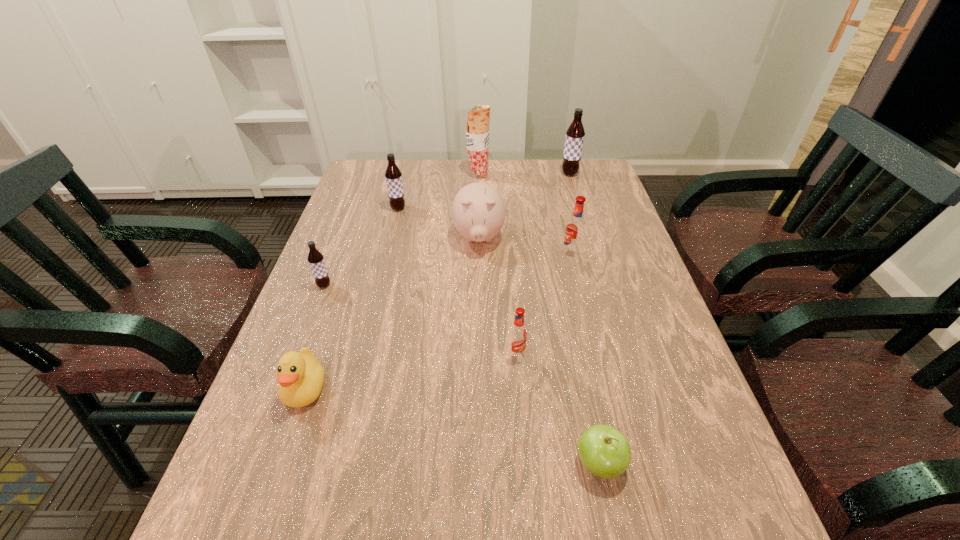
The height and width of the screenshot is (540, 960). In order to click on vacant space at the near edge of the desktop in this screenshot , I will do `click(338, 538)`.

Locate an element on the screen. vacant space at the left edge of the desktop is located at coordinates (315, 493).

In the image, there is a desktop. Identify the location of vacant space at the right edge. Image resolution: width=960 pixels, height=540 pixels. (609, 286).

At what (x,y) coordinates should I click in order to perform the action: click on vacant space at the near left corner. Please return your answer as a coordinate pair (x, y). Image resolution: width=960 pixels, height=540 pixels. Looking at the image, I should click on (257, 534).

The image size is (960, 540). Find the location of `vacant space at the far right corner of the desktop`. vacant space at the far right corner of the desktop is located at coordinates (568, 192).

Identify the location of vacant area between the burrito and the second shortest object. The height and width of the screenshot is (540, 960). (392, 281).

Locate an element on the screen. The image size is (960, 540). free space between the bigger red root beer and the second nearest root beer is located at coordinates pos(447,270).

I want to click on free space that is in between the nearest object and the farthest brown root beer, so point(585,319).

At what (x,y) coordinates should I click in order to perform the action: click on unoccupied position between the shortest object and the nearest brown root beer. Please return your answer as a coordinate pair (x, y). The width and height of the screenshot is (960, 540). Looking at the image, I should click on (462, 374).

Find the location of a particular element. This screenshot has height=540, width=960. vacant area between the third root beer from left to right and the tallest root beer is located at coordinates (543, 264).